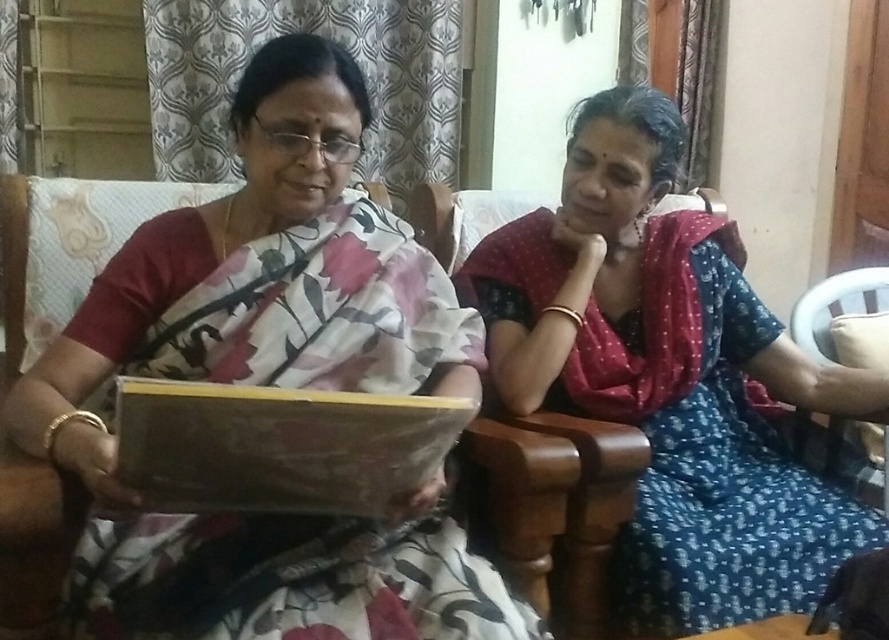
Can you confirm if floral silk saree at center is wider than blue printed saree at center?

No.

Which of these two, floral silk saree at center or blue printed saree at center, stands shorter?

floral silk saree at center

Where is `floral silk saree at center`? floral silk saree at center is located at coordinates (259, 278).